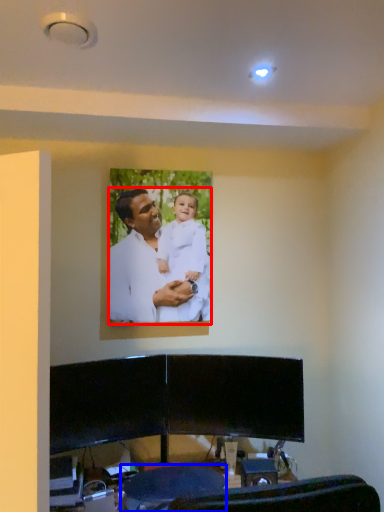
Question: Which object appears closest to the camera in this image, man (highlighted by a red box) or swivel chair (highlighted by a blue box)?

Choices:
 (A) man
 (B) swivel chair

Answer: (B)